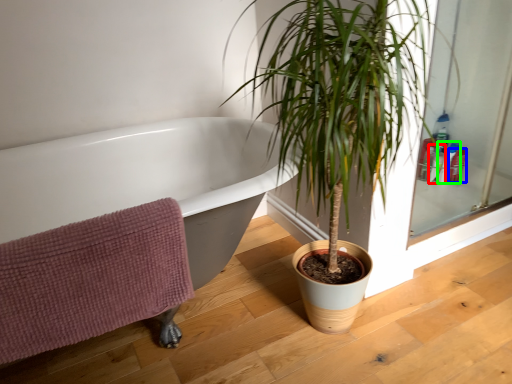
Question: Based on their relative distances, which object is nearer to toiletry (highlighted by a red box)? Choose from toiletry (highlighted by a blue box) and toiletry (highlighted by a green box).

Choices:
 (A) toiletry
 (B) toiletry

Answer: (B)